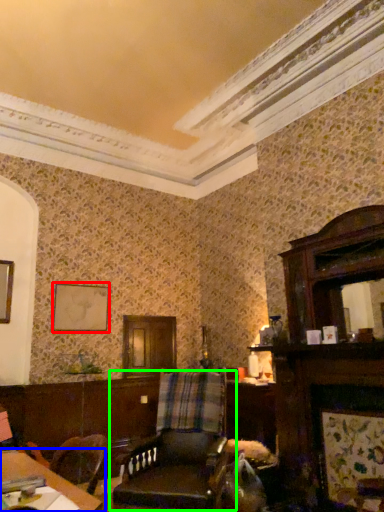
Question: Which is nearer to the picture frame (highlighted by a red box)? table (highlighted by a blue box) or chair (highlighted by a green box).

Choices:
 (A) table
 (B) chair

Answer: (B)